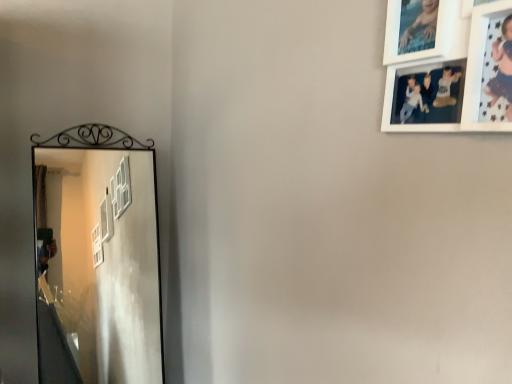
Image resolution: width=512 pixels, height=384 pixels. Describe the element at coordinates (464, 80) in the screenshot. I see `white matte picture frame at upper right` at that location.

What is the approximate height of white matte picture frame at upper right?

white matte picture frame at upper right is 10.37 inches in height.

Where is `white matte picture frame at upper right`? This screenshot has width=512, height=384. white matte picture frame at upper right is located at coordinates (464, 80).

Where is `white matte picture frame at upper right`? The height and width of the screenshot is (384, 512). white matte picture frame at upper right is located at coordinates (464, 80).